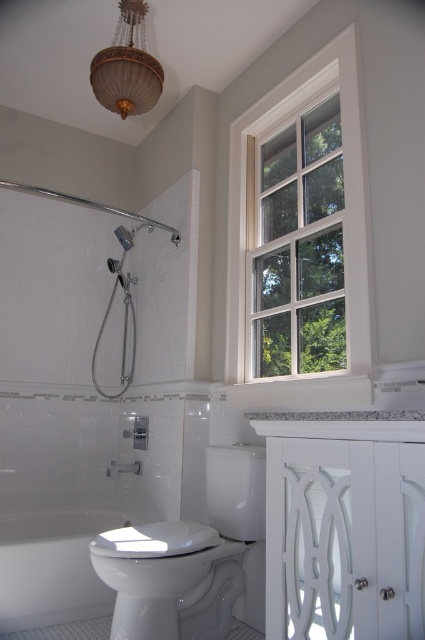
In the scene shown: Who is more distant from viewer, (198, 531) or (127, 93)?

The point (127, 93) is more distant.

Can you confirm if white glossy toilet bowl at lower center is taller than gold textured lampshade at upper center?

Indeed, white glossy toilet bowl at lower center has a greater height compared to gold textured lampshade at upper center.

Which is behind, point (161, 550) or point (124, 0)?

The point (124, 0) is more distant.

Find the location of a particular element. This screenshot has height=640, width=425. white glossy toilet bowl at lower center is located at coordinates (170, 579).

Can you confirm if white glossy bathtub at lower left is wider than matte silver shower head at upper left?

Indeed, white glossy bathtub at lower left has a greater width compared to matte silver shower head at upper left.

Which is more to the left, white glossy bathtub at lower left or matte silver shower head at upper left?

From the viewer's perspective, white glossy bathtub at lower left appears more on the left side.

Between point (53, 593) and point (125, 248), which one is positioned in front?

Point (53, 593) is in front.

The image size is (425, 640). What are the coordinates of `white glossy bathtub at lower left` in the screenshot? It's located at (51, 566).

Is white glossy bathtub at lower left shorter than gold textured lampshade at upper center?

Yes.

Which is in front, point (78, 520) or point (98, 88)?

Point (98, 88)

Image resolution: width=425 pixels, height=640 pixels. Describe the element at coordinates (51, 566) in the screenshot. I see `white glossy bathtub at lower left` at that location.

Find the location of a particular element. white glossy bathtub at lower left is located at coordinates point(51,566).